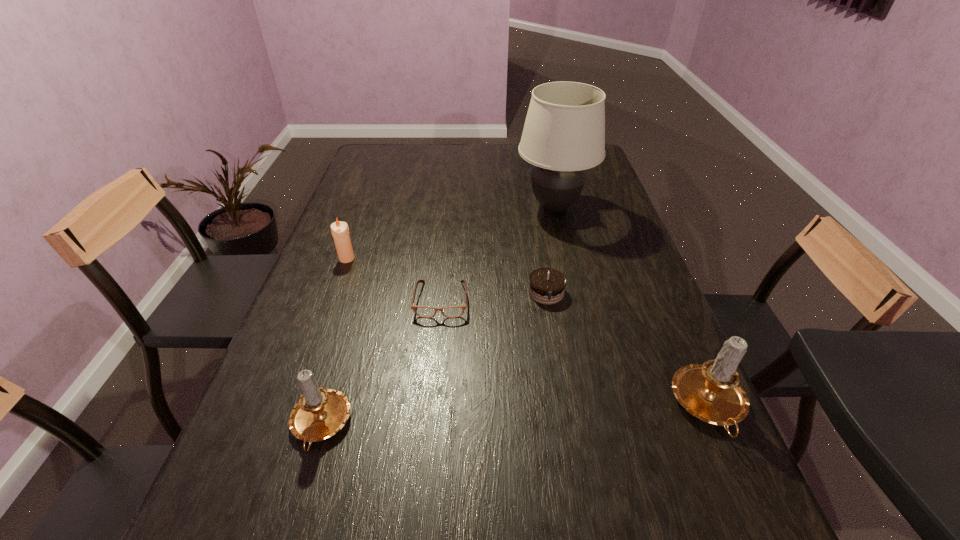
The image size is (960, 540). Find the location of `free space at the right edge of the desktop`. free space at the right edge of the desktop is located at coordinates (636, 368).

I want to click on vacant space at the far left corner, so click(398, 147).

Locate an element on the screen. vacant space at the near left corner of the desktop is located at coordinates (260, 458).

You are a GUI agent. You are given a task and a screenshot of the screen. Output one action in this format:
    pyautogui.click(x=<x>, y=<y>)
    Task: Click on the empty space between the second tallest object and the tallest object
    This screenshot has height=540, width=960.
    Given the screenshot: What is the action you would take?
    pyautogui.click(x=632, y=307)

At what (x,y) coordinates should I click in order to perform the action: click on vacant space that is in between the second shortest object and the shortest object. Please return your answer as a coordinate pair (x, y). The height and width of the screenshot is (540, 960). Looking at the image, I should click on (493, 296).

This screenshot has height=540, width=960. In order to click on vacant area that lies between the fifth nearest object and the shortest object in this screenshot , I will do `click(394, 279)`.

The width and height of the screenshot is (960, 540). Find the location of `vacant region between the lampshade and the chocolate cake`. vacant region between the lampshade and the chocolate cake is located at coordinates (550, 250).

You are a GUI agent. You are given a task and a screenshot of the screen. Output one action in this format:
    pyautogui.click(x=<x>, y=<y>)
    Task: Click on the vacant region between the second farthest object and the chocolate cake
    
    Given the screenshot: What is the action you would take?
    pyautogui.click(x=446, y=275)

At what (x,y) coordinates should I click in order to perform the action: click on vacant area that lies between the farthest candle and the chocolate cake. Please return your answer as a coordinate pair (x, y). This screenshot has width=960, height=540. Looking at the image, I should click on (446, 275).

The width and height of the screenshot is (960, 540). I want to click on vacant area that lies between the shortest object and the rightmost object, so click(575, 354).